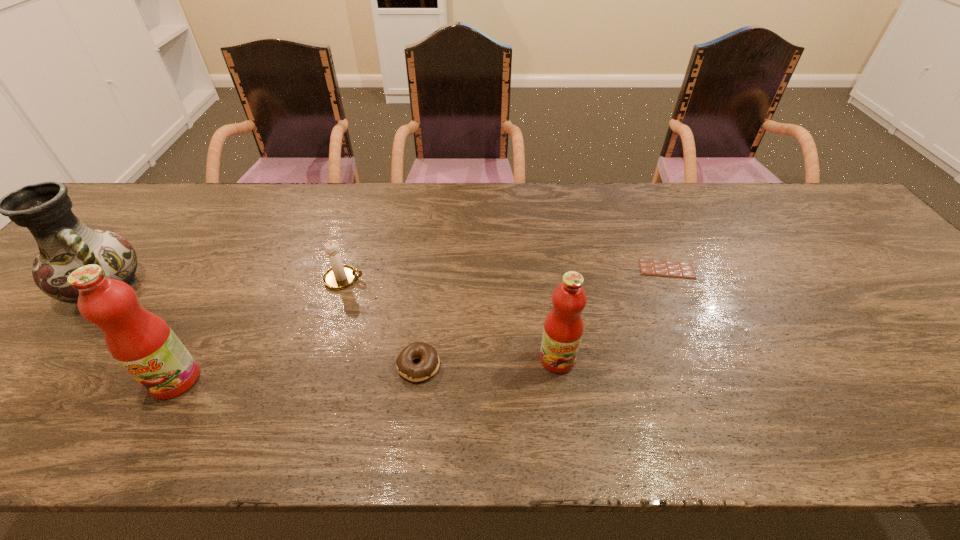
This screenshot has height=540, width=960. What are the coordinates of `the left fruit juice` in the screenshot? It's located at (140, 341).

Image resolution: width=960 pixels, height=540 pixels. I want to click on the taller fruit juice, so click(x=140, y=341).

At what (x,y) coordinates should I click in order to perform the action: click on the right fruit juice. Please return your answer as a coordinate pair (x, y). The image size is (960, 540). Looking at the image, I should click on (563, 328).

At what (x,y) coordinates should I click in order to perform the action: click on the shorter fruit juice. Please return your answer as a coordinate pair (x, y). Image resolution: width=960 pixels, height=540 pixels. Looking at the image, I should click on (563, 328).

Identify the location of the shortest object. (647, 267).

You are a GUI agent. You are given a task and a screenshot of the screen. Output one action in this format:
    pyautogui.click(x=<x>, y=<y>)
    Task: Click on the rightmost object
    
    Given the screenshot: What is the action you would take?
    pyautogui.click(x=647, y=267)

Identify the location of the third shortest object. (339, 276).

The height and width of the screenshot is (540, 960). I want to click on candle holder, so click(339, 276).

I want to click on vase, so click(x=65, y=243).

Identify the location of the fourth object from left to right. Image resolution: width=960 pixels, height=540 pixels. (429, 364).